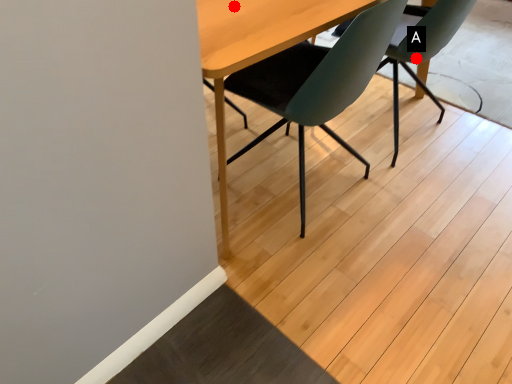
Question: Two points are circled on the image, labeled by A and B beside each circle. Which point is closer to the camera?

Choices:
 (A) A is closer
 (B) B is closer

Answer: (B)